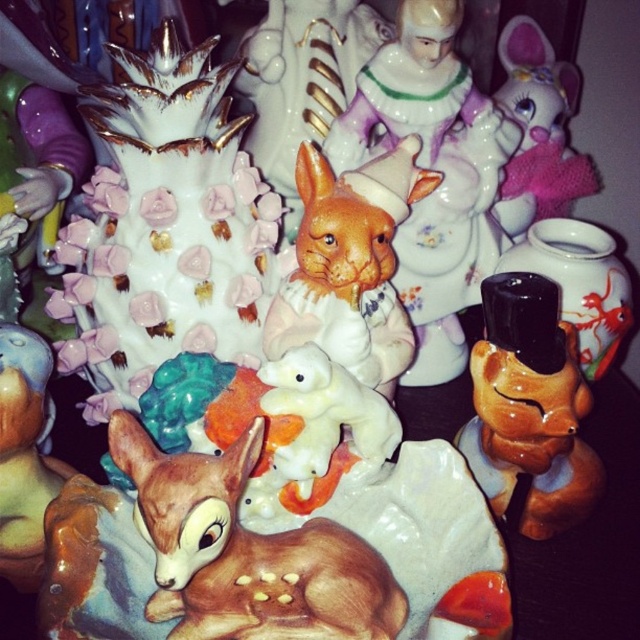
Question: Among these points, which one is nearest to the camera?

Choices:
 (A) (29, 532)
 (B) (204, 573)
 (C) (342, 272)

Answer: (B)

Question: Is glossy ceramic fox at right smaller than matte ceramic deer at lower left?

Choices:
 (A) yes
 (B) no

Answer: (B)

Question: Is brown glossy deer at lower left further to camera compared to matte ceramic rabbit at center?

Choices:
 (A) no
 (B) yes

Answer: (A)

Question: Among these objects, which one is nearest to the camera?

Choices:
 (A) brown glossy deer at lower left
 (B) matte ceramic cat at center

Answer: (A)

Question: Which point is closer to the camera?

Choices:
 (A) brown glossy deer at lower left
 (B) matte ceramic rabbit at center

Answer: (A)

Question: Is matte ceramic deer at lower left above matte black vase at right?

Choices:
 (A) yes
 (B) no

Answer: (B)